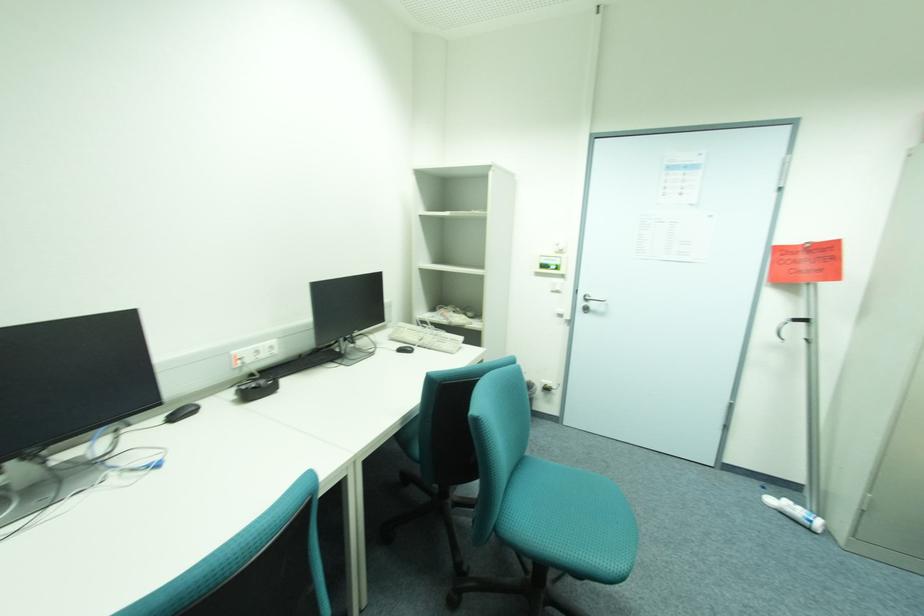
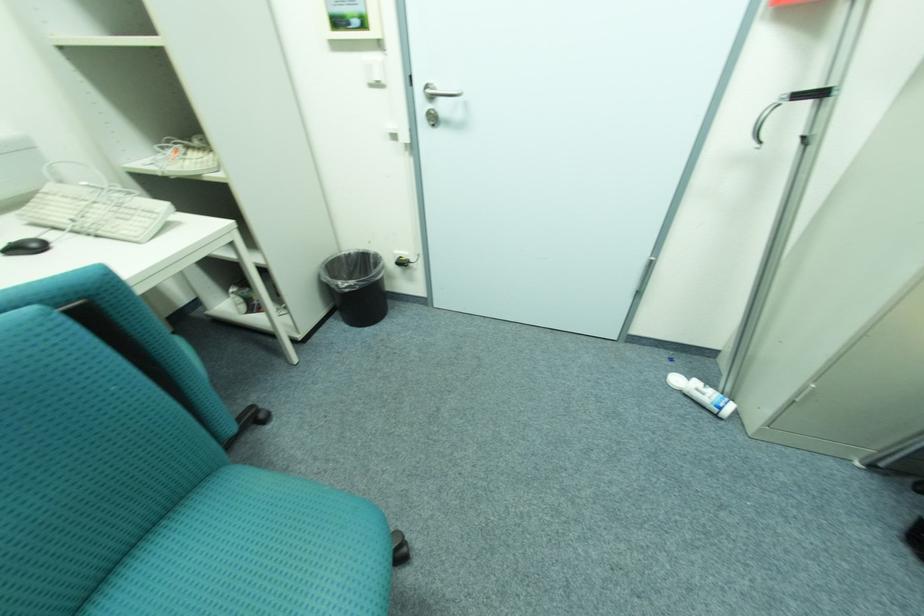
Where in the second image is the point corresponding to the point at 417,350 from the first image?

(43, 246)